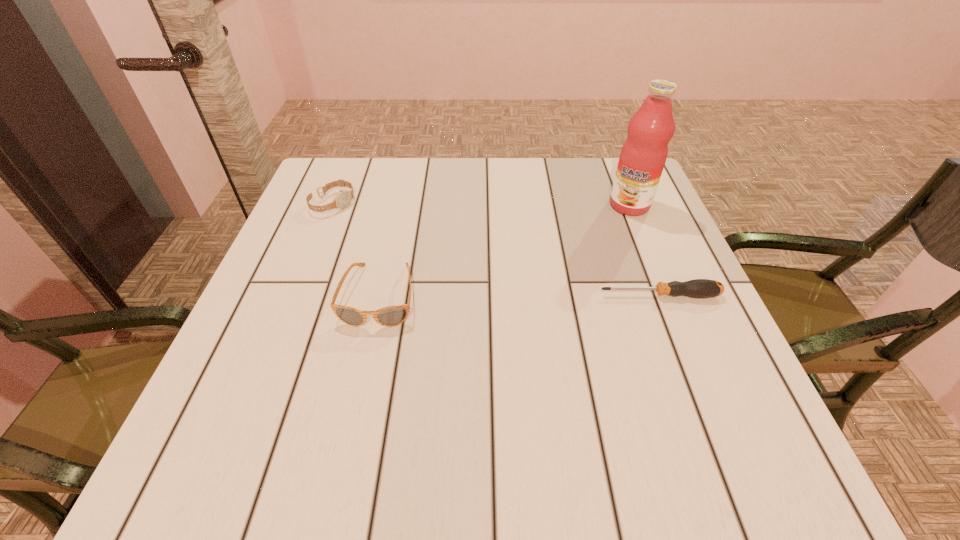
What are the coordinates of `sunglasses` in the screenshot? It's located at (390, 316).

At what (x,y) coordinates should I click in order to perform the action: click on screwdriver. Please return your answer as a coordinate pair (x, y). This screenshot has width=960, height=540. Looking at the image, I should click on (698, 288).

The width and height of the screenshot is (960, 540). In order to click on the tallest object in this screenshot , I will do `click(643, 155)`.

The height and width of the screenshot is (540, 960). I want to click on watch, so click(x=343, y=198).

Where is `vacant area situated on the front-facing side of the third object from right to left`? The image size is (960, 540). vacant area situated on the front-facing side of the third object from right to left is located at coordinates (362, 379).

Locate an element on the screen. blank space located 0.140m on the label of the tallest object is located at coordinates (596, 246).

In order to click on free spot located 0.330m on the label of the tallest object in this screenshot , I will do `click(554, 295)`.

I want to click on free region located 0.350m on the label of the tallest object, so click(x=549, y=301).

Image resolution: width=960 pixels, height=540 pixels. I want to click on free location located 0.320m on the face of the leftmost object, so click(447, 266).

This screenshot has width=960, height=540. Identify the location of vacant space situated on the face of the leftmost object. (378, 228).